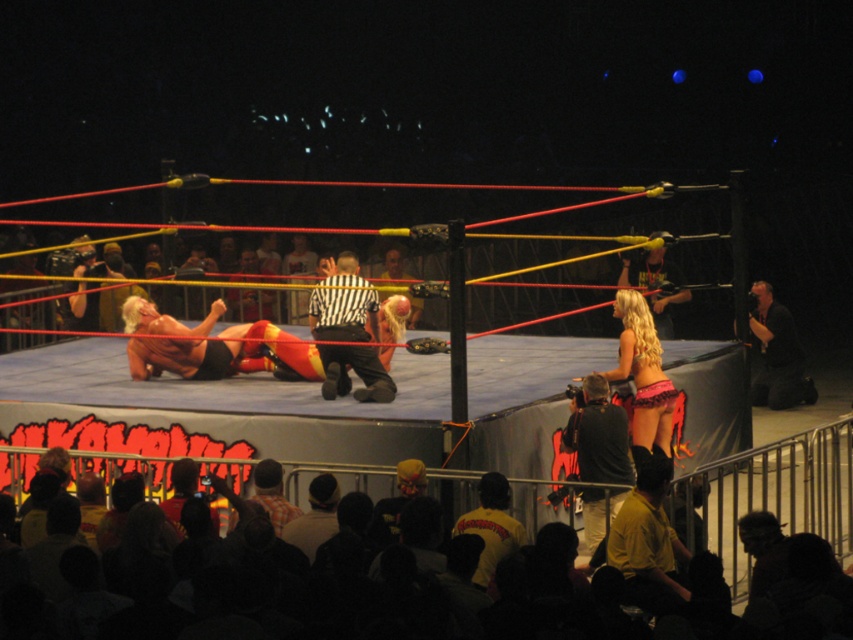
Question: Which point appears closest to the camera in this image?

Choices:
 (A) (653, 554)
 (B) (799, 358)
 (C) (653, 316)
 (D) (666, 454)

Answer: (A)

Question: Which of the following is the farthest from the observer?

Choices:
 (A) (595, 508)
 (B) (347, 278)
 (C) (647, 340)

Answer: (B)

Question: Based on their relative distances, which object is farther from the black and white striped shirt at center?

Choices:
 (A) black leather jacket at upper right
 (B) shiny black leather jacket at upper right
 (C) black leather camera at lower right

Answer: (A)

Question: Is black leather camera at lower right in front of black leather jacket at upper right?

Choices:
 (A) yes
 (B) no

Answer: (A)

Question: Is black and white striped shirt at center smaller than pink fabric bikini at center?

Choices:
 (A) yes
 (B) no

Answer: (A)

Question: Does black and white striped shirt at center have a larger size compared to shiny black leather jacket at upper right?

Choices:
 (A) yes
 (B) no

Answer: (B)